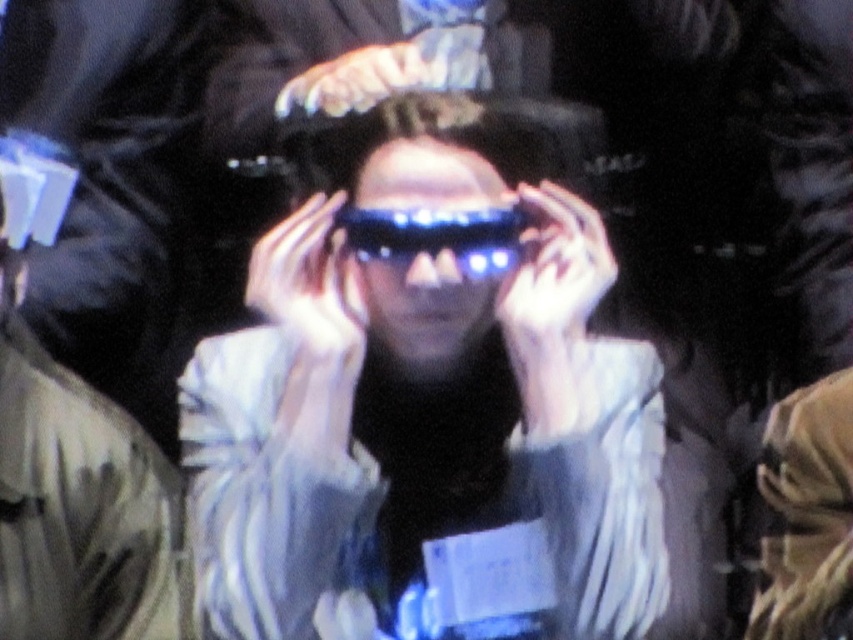
Question: Among these points, which one is nearest to the camera?

Choices:
 (A) (498, 216)
 (B) (241, 620)

Answer: (B)

Question: Which object appears farthest from the camera in this image?

Choices:
 (A) shiny metallic glasses at center
 (B) blue plastic goggles at center

Answer: (B)

Question: Is the position of shiny metallic glasses at center more distant than that of blue plastic goggles at center?

Choices:
 (A) yes
 (B) no

Answer: (B)

Question: Is shiny metallic glasses at center bigger than blue plastic goggles at center?

Choices:
 (A) yes
 (B) no

Answer: (A)

Question: Is shiny metallic glasses at center thinner than blue plastic goggles at center?

Choices:
 (A) no
 (B) yes

Answer: (A)